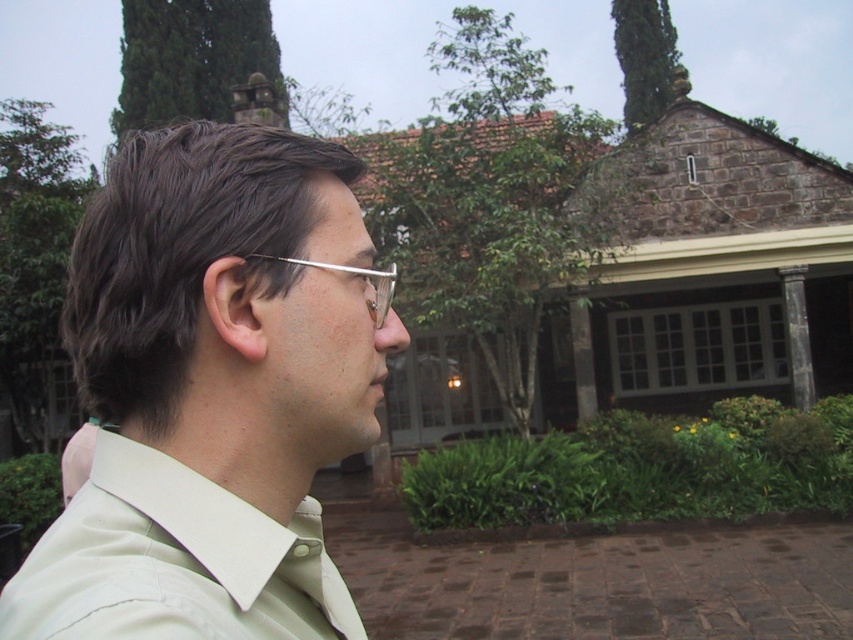
You are standing at the position of the man in the image and want to walk towards the building. Which point, point (x=292, y=413) or point (x=45, y=564), will you reach first?

You will reach point (x=45, y=564) first because it is closer to you than point (x=292, y=413), which is further away.

You are a fashion designer observing a man wearing two shirts in the image. The shirts are labeled as light beige shirt at center and beige cotton dress shirt at center. Which of these shirts is taller in the image?

The light beige shirt at center has a greater height compared to the beige cotton dress shirt at center, so the light beige shirt at center is taller.

Based on the coordinates provided in the scene, where is the beige cotton dress shirt at center located in the image?

The beige cotton dress shirt at center is located at the 2D coordinate point of 0.880 on the x axis and 0.205 on the y axis.